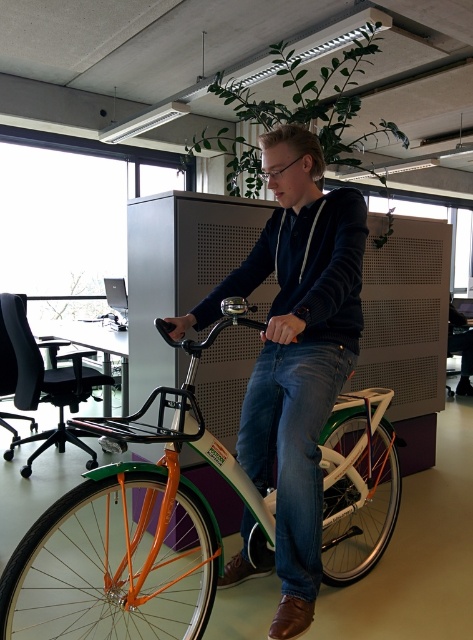
You are planning to store the orange matte bicycle at center and the matte black hoodie at center in a vertical storage unit. Given their heights, which object should be placed on the lower shelf to ensure stability?

The orange matte bicycle at center should be placed on the lower shelf because it has a lesser height compared to the matte black hoodie at center, ensuring stability by placing the shorter item lower.

You are planning to hang a picture frame above the orange matte bicycle at center. According to the scene, can the picture frame be placed above the bicycle without overlapping the matte black hoodie at center?

The orange matte bicycle at center is positioned under the matte black hoodie at center, so placing the picture frame above the bicycle would risk overlapping the hoodie, making it inadvisable.